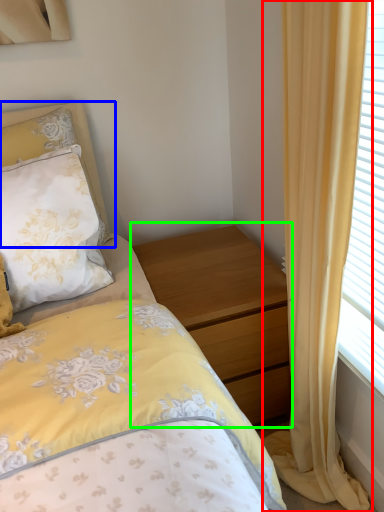
Question: Which object is positioned closest to curtain (highlighted by a red box)? Select from pillow (highlighted by a blue box) and nightstand (highlighted by a green box).

Choices:
 (A) pillow
 (B) nightstand

Answer: (B)